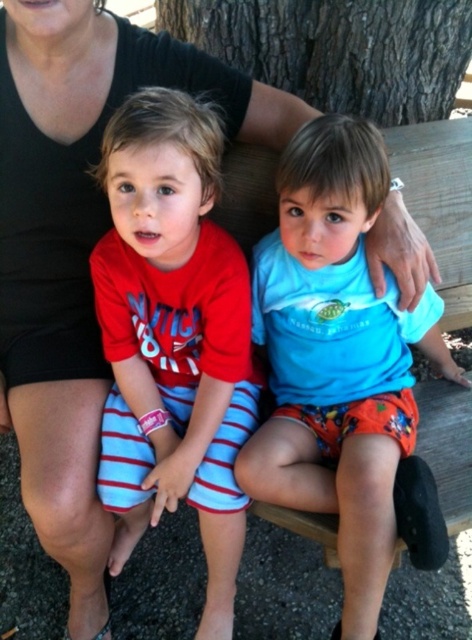
Question: Is blue matte shirt at center closer to the viewer compared to brown rough bark at upper center?

Choices:
 (A) yes
 (B) no

Answer: (A)

Question: Among these points, which one is farthest from the camera?

Choices:
 (A) (370, 196)
 (B) (224, 301)

Answer: (B)

Question: Does red striped shorts at center appear on the left side of brown rough bark at upper center?

Choices:
 (A) yes
 (B) no

Answer: (A)

Question: Which of these objects is positioned farthest from the blue matte shirt at center?

Choices:
 (A) red striped shorts at center
 (B) brown rough bark at upper center

Answer: (B)

Question: Is blue matte shirt at center further to the viewer compared to brown rough bark at upper center?

Choices:
 (A) yes
 (B) no

Answer: (B)

Question: Which of these objects is positioned closest to the red striped shorts at center?

Choices:
 (A) brown rough bark at upper center
 (B) blue matte shirt at center

Answer: (B)